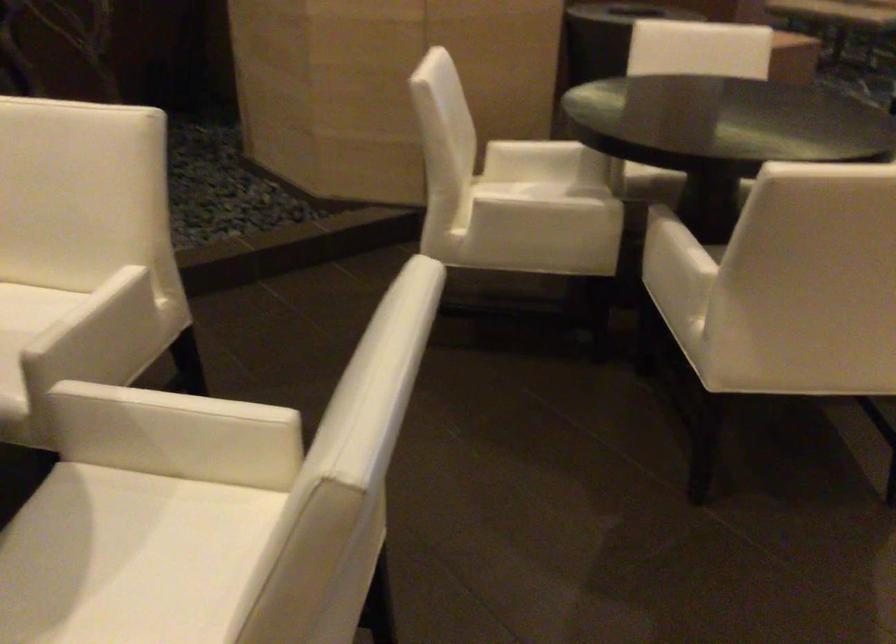
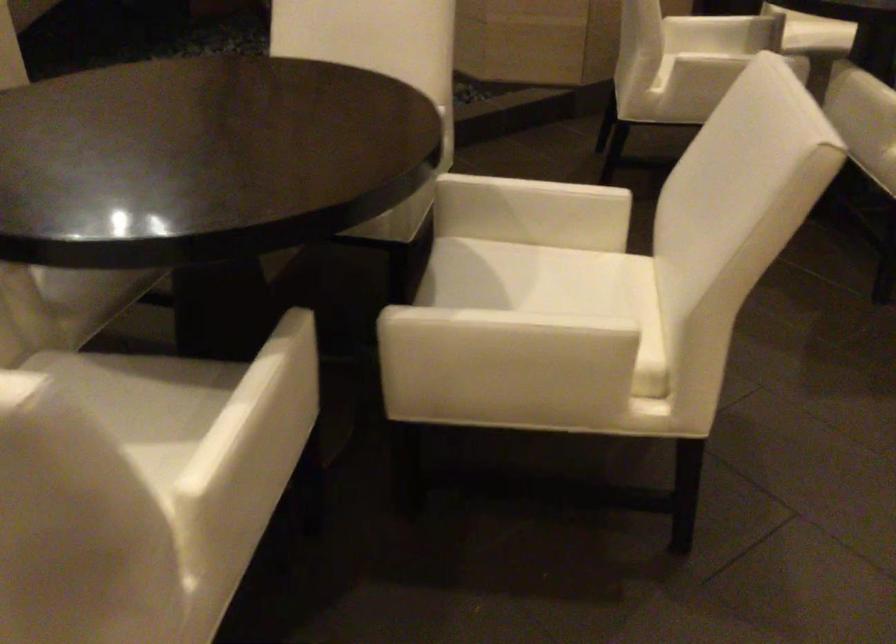
Find the pixel in the second image that matches point 183,406 in the first image.

(538, 185)